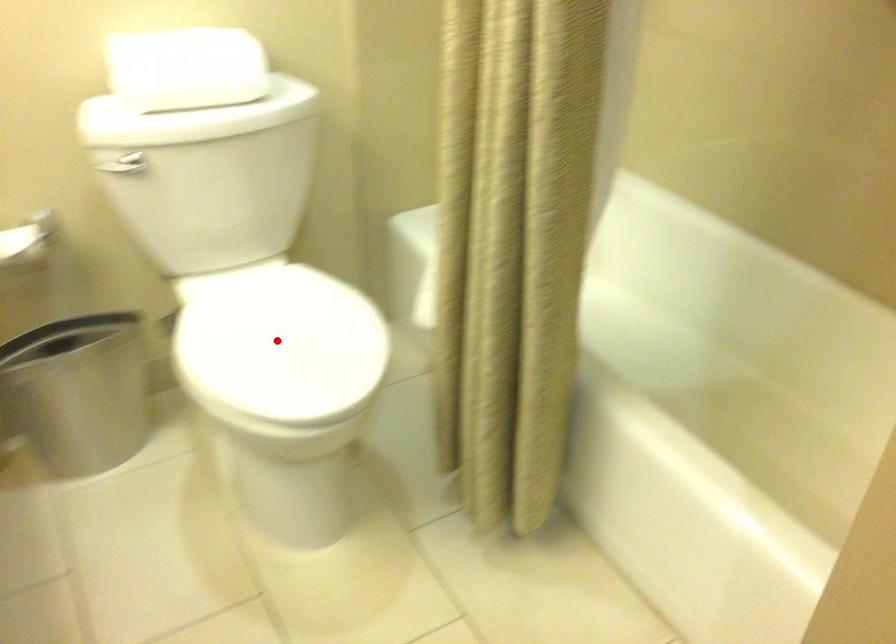
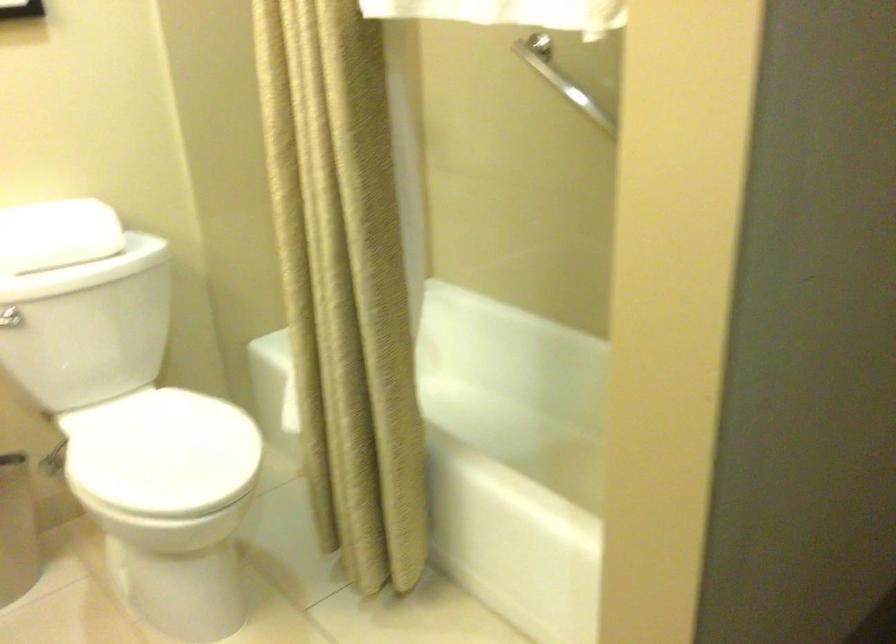
Question: I am providing you with two images of the same scene from different viewpoints. A red point is marked on the first image. Can you still see the location of the red point in image 2?

Choices:
 (A) Yes
 (B) No

Answer: (A)